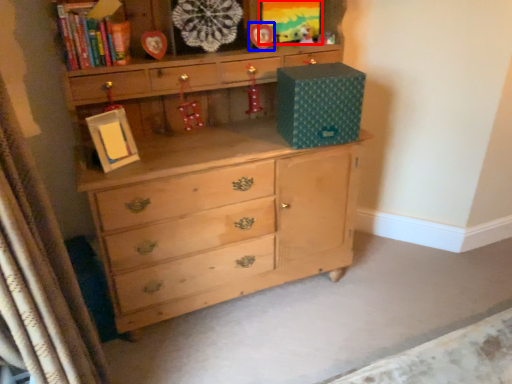
Question: Which object is further to the camera taking this photo, picture frame (highlighted by a red box) or picture frame (highlighted by a blue box)?

Choices:
 (A) picture frame
 (B) picture frame

Answer: (A)